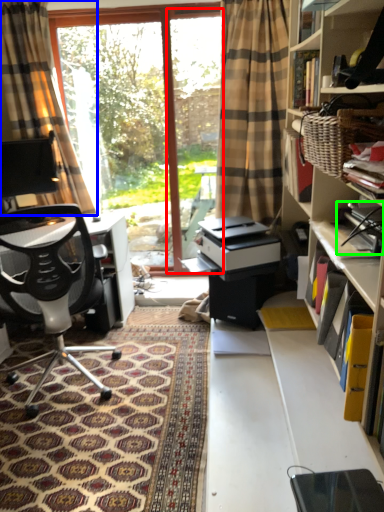
Question: Which object is the farthest from screen door (highlighted by a red box)? Choose among these: curtain (highlighted by a blue box) or book (highlighted by a green box).

Choices:
 (A) curtain
 (B) book

Answer: (B)